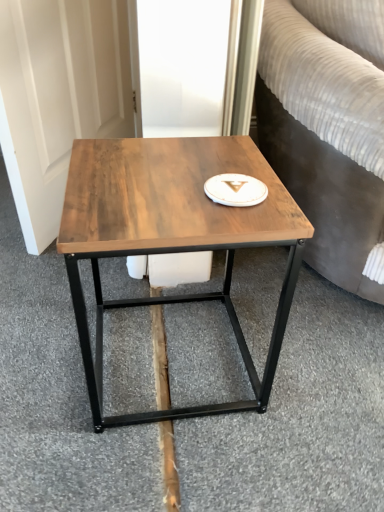
Question: Does wooden table at center have a lesser width compared to white glossy platter at center?

Choices:
 (A) no
 (B) yes

Answer: (A)

Question: Is wooden table at center outside of white glossy platter at center?

Choices:
 (A) yes
 (B) no

Answer: (A)

Question: Does wooden table at center have a larger size compared to white glossy platter at center?

Choices:
 (A) no
 (B) yes

Answer: (B)

Question: Can you confirm if wooden table at center is wider than white glossy platter at center?

Choices:
 (A) no
 (B) yes

Answer: (B)

Question: Could you tell me if wooden table at center is facing white glossy platter at center?

Choices:
 (A) yes
 (B) no

Answer: (B)

Question: From a real-world perspective, is brown wood plank at center physically located above or below wooden table at center?

Choices:
 (A) below
 (B) above

Answer: (A)

Question: Considering the positions of brown wood plank at center and wooden table at center in the image, is brown wood plank at center bigger or smaller than wooden table at center?

Choices:
 (A) big
 (B) small

Answer: (B)

Question: Considering the relative positions of brown wood plank at center and wooden table at center in the image provided, is brown wood plank at center to the left or to the right of wooden table at center?

Choices:
 (A) left
 (B) right

Answer: (A)

Question: From the image's perspective, is brown wood plank at center above or below wooden table at center?

Choices:
 (A) below
 (B) above

Answer: (A)

Question: From the image's perspective, is brown wood plank at center above or below white glossy platter at center?

Choices:
 (A) below
 (B) above

Answer: (A)

Question: Would you say brown wood plank at center is inside or outside white glossy platter at center?

Choices:
 (A) inside
 (B) outside

Answer: (B)

Question: From their relative heights in the image, would you say brown wood plank at center is taller or shorter than white glossy platter at center?

Choices:
 (A) short
 (B) tall

Answer: (B)

Question: Is brown wood plank at center in front of or behind white glossy platter at center in the image?

Choices:
 (A) front
 (B) behind

Answer: (B)

Question: Is point (231, 197) positioned closer to the camera than point (190, 157)?

Choices:
 (A) closer
 (B) farther

Answer: (A)

Question: Choose the correct answer: Is white glossy platter at center inside wooden table at center or outside it?

Choices:
 (A) outside
 (B) inside

Answer: (B)